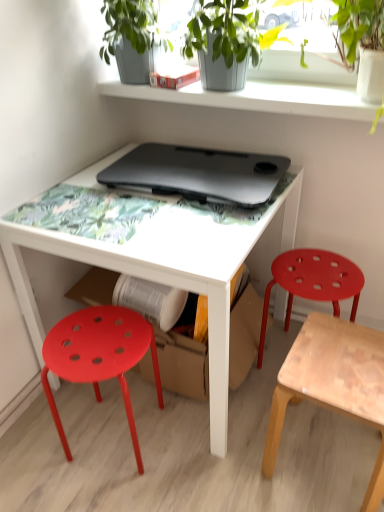
Question: Does smooth gray concrete shelf at upper center appear on the left side of matte plastic stool at right, which is the 3th stool from left to right?

Choices:
 (A) yes
 (B) no

Answer: (A)

Question: From a real-world perspective, is smooth gray concrete shelf at upper center over matte plastic stool at right, which is the 3th stool from left to right?

Choices:
 (A) no
 (B) yes

Answer: (B)

Question: Is smooth gray concrete shelf at upper center at the right side of matte plastic stool at right, which is the 3th stool from left to right?

Choices:
 (A) no
 (B) yes

Answer: (A)

Question: Does smooth gray concrete shelf at upper center have a lesser height compared to matte plastic stool at right, which is the 3th stool from left to right?

Choices:
 (A) no
 (B) yes

Answer: (B)

Question: From the image's perspective, is smooth gray concrete shelf at upper center over matte plastic stool at right, which is the 3th stool from left to right?

Choices:
 (A) no
 (B) yes

Answer: (B)

Question: From the image's perspective, is green matte plant at upper center positioned above or below light brown wooden stool at lower right, marked as the 2th stool in a left-to-right arrangement?

Choices:
 (A) above
 (B) below

Answer: (A)

Question: Is green matte plant at upper center bigger or smaller than light brown wooden stool at lower right, marked as the 2th stool in a left-to-right arrangement?

Choices:
 (A) small
 (B) big

Answer: (A)

Question: In the image, is green matte plant at upper center on the left side or the right side of light brown wooden stool at lower right, marked as the 2th stool in a left-to-right arrangement?

Choices:
 (A) left
 (B) right

Answer: (A)

Question: From a real-world perspective, is green matte plant at upper center positioned above or below light brown wooden stool at lower right, marked as the 2th stool in a left-to-right arrangement?

Choices:
 (A) below
 (B) above

Answer: (B)

Question: From a real-world perspective, is light brown wooden stool at lower right, marked as the 2th stool in a left-to-right arrangement, positioned above or below matte plastic stool at lower left, which ranks as the 3th stool in right-to-left order?

Choices:
 (A) below
 (B) above

Answer: (A)

Question: From the image's perspective, is light brown wooden stool at lower right, which appears as the second stool when viewed from the right, positioned above or below matte plastic stool at lower left, which ranks as the 3th stool in right-to-left order?

Choices:
 (A) below
 (B) above

Answer: (A)

Question: Looking at their shapes, would you say light brown wooden stool at lower right, which appears as the second stool when viewed from the right, is wider or thinner than matte plastic stool at lower left, which ranks as the 3th stool in right-to-left order?

Choices:
 (A) thin
 (B) wide

Answer: (B)

Question: Is light brown wooden stool at lower right, which appears as the second stool when viewed from the right, taller or shorter than matte plastic stool at lower left, which ranks as the 3th stool in right-to-left order?

Choices:
 (A) tall
 (B) short

Answer: (B)

Question: From a real-world perspective, relative to black matte laptop at center, is matte plastic stool at right, which is the 3th stool from left to right, vertically above or below?

Choices:
 (A) above
 (B) below

Answer: (B)

Question: Would you say matte plastic stool at right, which is the 3th stool from left to right, is to the left or to the right of black matte laptop at center in the picture?

Choices:
 (A) left
 (B) right

Answer: (B)